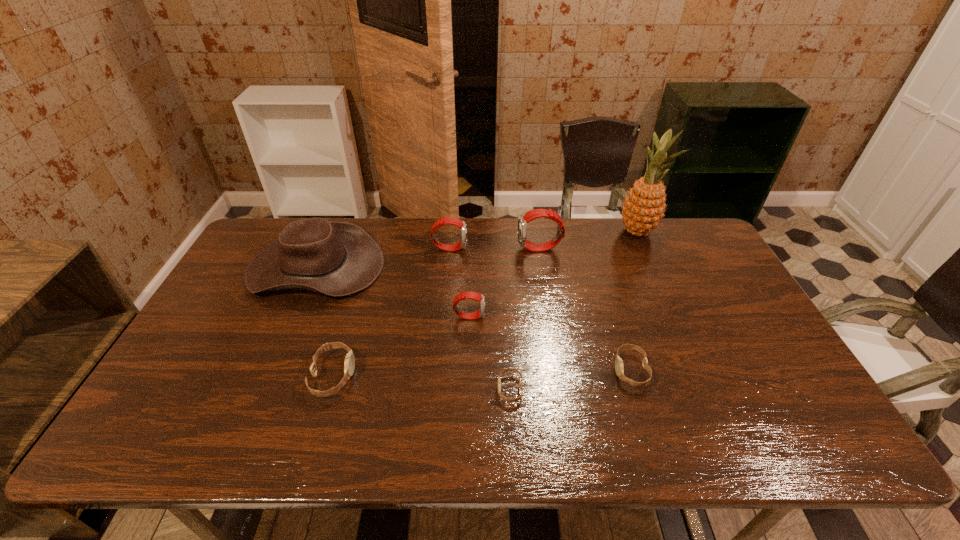
Image resolution: width=960 pixels, height=540 pixels. I want to click on free point between the fourth tallest object and the biggest beige watch, so click(392, 312).

Where is `vacant region between the rightmost object and the cowboy hat`? vacant region between the rightmost object and the cowboy hat is located at coordinates (476, 249).

What are the coordinates of `vacant region between the cowboy hat and the fifth object from left to right` in the screenshot? It's located at (413, 328).

Locate an element on the screen. The width and height of the screenshot is (960, 540). unoccupied position between the cowboy hat and the fifth tallest object is located at coordinates (392, 292).

The width and height of the screenshot is (960, 540). Identify the location of unoccupied area between the tallest object and the leftmost watch. (485, 303).

This screenshot has width=960, height=540. I want to click on empty location between the tallest object and the fourth shortest object, so click(553, 274).

Identify the location of free spot between the fourth object from right to left and the fourth shortest watch. (490, 353).

This screenshot has width=960, height=540. I want to click on vacant area that lies between the biggest beige watch and the third farthest watch, so click(401, 346).

The width and height of the screenshot is (960, 540). What are the coordinates of `vacant area between the leftmost beige watch and the cowboy hat` in the screenshot? It's located at (324, 321).

Choose which object is the third nearest neighbor to the seventh tallest object. Please provide its 2D coordinates. Your answer should be formatted as a tuple, i.e. [(x, y)], where the tuple contains the x and y coordinates of a point satisfying the conditions above.

[(536, 213)]